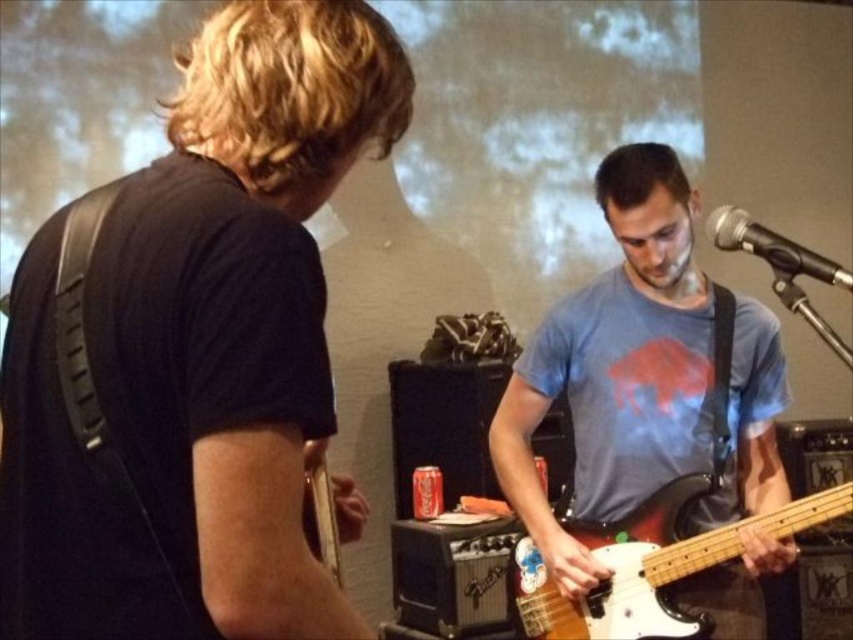
Question: Does black matte guitar at left appear on the left side of metallic silver microphone at upper right?

Choices:
 (A) yes
 (B) no

Answer: (A)

Question: Which point is closer to the camera taking this photo?

Choices:
 (A) (48, 372)
 (B) (729, 506)
 (C) (674, 520)
 (D) (817, 256)

Answer: (A)

Question: Is blue cotton t-shirt at center closer to the viewer compared to wooden electric bass at center?

Choices:
 (A) yes
 (B) no

Answer: (B)

Question: Is black matte guitar at left positioned at the back of metallic silver microphone at upper right?

Choices:
 (A) no
 (B) yes

Answer: (A)

Question: Among these objects, which one is nearest to the camera?

Choices:
 (A) black matte guitar at left
 (B) blue cotton t-shirt at center

Answer: (A)

Question: Among these objects, which one is farthest from the camera?

Choices:
 (A) metallic silver microphone at upper right
 (B) blue cotton t-shirt at center
 (C) wooden electric bass at center

Answer: (B)